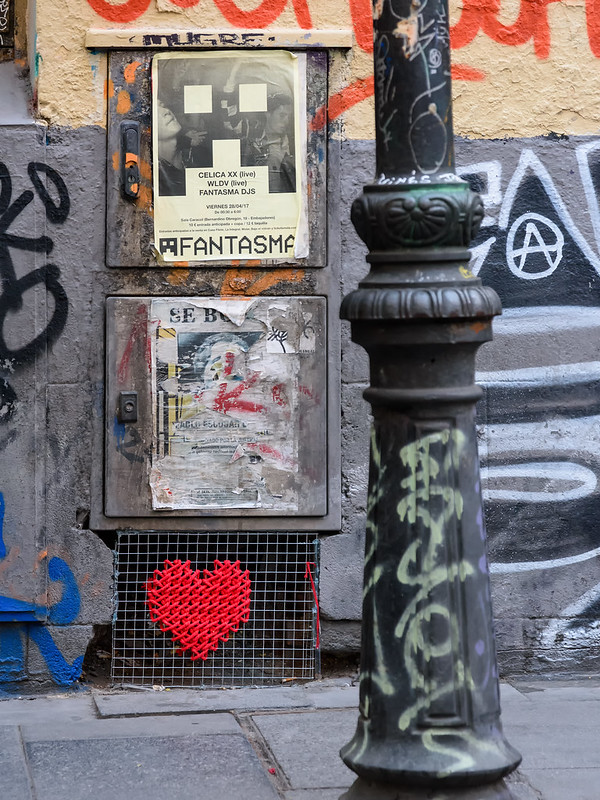
Find the location of `top door`. top door is located at coordinates (133, 100).